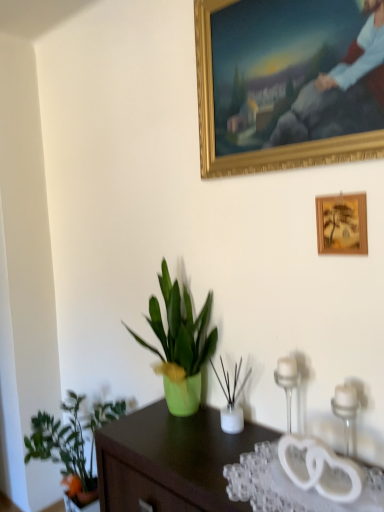
Question: Can you confirm if green matte vase at center, which appears as the 2th houseplant when ordered from the bottom, is smaller than green matte plant at center, marked as the 2th houseplant in a right-to-left arrangement?

Choices:
 (A) no
 (B) yes

Answer: (B)

Question: From the image's perspective, is green matte vase at center, which ranks as the third houseplant in left-to-right order, beneath green matte plant at center, which is the 3th houseplant in bottom-to-top order?

Choices:
 (A) no
 (B) yes

Answer: (B)

Question: Is green matte vase at center, arranged as the 2th houseplant when viewed from the top, surrounding green matte plant at center, which appears as the 2th houseplant when viewed from the left?

Choices:
 (A) yes
 (B) no

Answer: (B)

Question: Is green matte vase at center, placed as the first houseplant when sorted from right to left, behind green matte plant at center, marked as the 2th houseplant in a right-to-left arrangement?

Choices:
 (A) no
 (B) yes

Answer: (A)

Question: Considering the relative sizes of green matte vase at center, which ranks as the third houseplant in left-to-right order, and green matte plant at center, marked as the first houseplant in a top-to-bottom arrangement, in the image provided, is green matte vase at center, which ranks as the third houseplant in left-to-right order, shorter than green matte plant at center, marked as the first houseplant in a top-to-bottom arrangement,?

Choices:
 (A) yes
 (B) no

Answer: (A)

Question: Can you confirm if green matte vase at center, placed as the first houseplant when sorted from right to left, is positioned to the right of green matte plant at center, which is the 3th houseplant in bottom-to-top order?

Choices:
 (A) no
 (B) yes

Answer: (B)

Question: Can you confirm if transparent plastic glass table at lower right is wider than green matte plant at center, marked as the 2th houseplant in a right-to-left arrangement?

Choices:
 (A) yes
 (B) no

Answer: (A)

Question: Is transparent plastic glass table at lower right completely or partially outside of green matte plant at center, which is the 3th houseplant in bottom-to-top order?

Choices:
 (A) yes
 (B) no

Answer: (A)

Question: Does transparent plastic glass table at lower right contain green matte plant at center, marked as the first houseplant in a top-to-bottom arrangement?

Choices:
 (A) yes
 (B) no

Answer: (B)

Question: From the image's perspective, is transparent plastic glass table at lower right located above green matte plant at center, which appears as the 2th houseplant when viewed from the left?

Choices:
 (A) yes
 (B) no

Answer: (B)

Question: Is transparent plastic glass table at lower right facing away from green matte plant at center, which is the 3th houseplant in bottom-to-top order?

Choices:
 (A) yes
 (B) no

Answer: (B)

Question: Is transparent plastic glass table at lower right taller than green matte plant at center, marked as the 2th houseplant in a right-to-left arrangement?

Choices:
 (A) yes
 (B) no

Answer: (B)

Question: Is clear glass candle holder at right, the 1th candle holder in the left-to-right sequence, shorter than green matte plant at lower left, which is the 3th houseplant in top-to-bottom order?

Choices:
 (A) no
 (B) yes

Answer: (B)